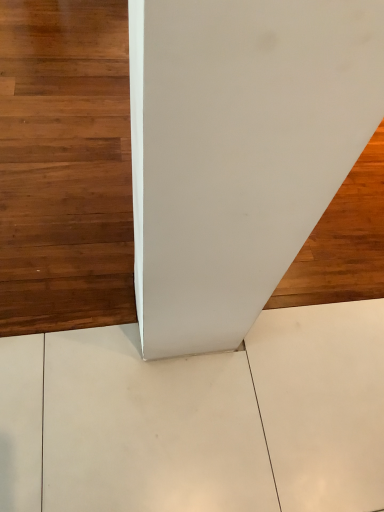
The width and height of the screenshot is (384, 512). Describe the element at coordinates (65, 166) in the screenshot. I see `wooden floor at lower left` at that location.

Identify the location of wooden floor at lower left. This screenshot has width=384, height=512. (65, 166).

Locate an element on the screen. This screenshot has height=512, width=384. wooden floor at lower left is located at coordinates (65, 166).